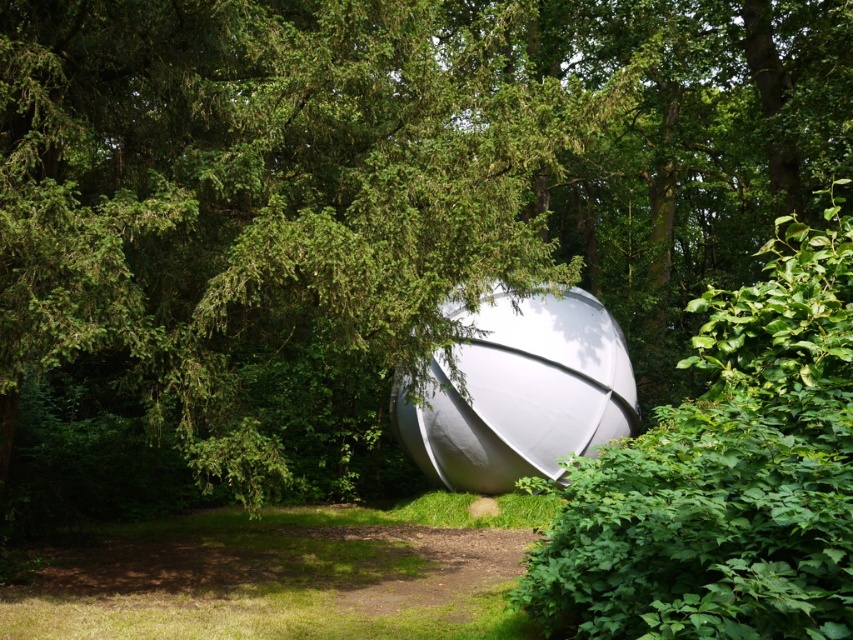
You are a hiker who wants to place a small backpack on the green grass at lower center. However, you need to ensure that the backpack won not block the view of the white matte sphere at center. Can you do this?

The green grass at lower center is not as tall as the white matte sphere at center, so placing the backpack there would not block the view of the white matte sphere at center since the sphere is taller.

You are a hiker who wants to place a small backpack on the ground near the green leafy bush at center. However, you notice the green grass at lower center. Which area would be more suitable for placing your backpack to avoid it being hidden by vegetation?

The green grass at lower center is shorter than the green leafy bush at center, so placing the backpack on the green grass at lower center would prevent it from being hidden by taller vegetation.

You are a hiker who wants to place a small backpack on the ground near the white matte sphere at center. Based on the scene, where should you place it so it stays on the green grass at lower center?

A: You should place the backpack on the green grass at lower center since it is located below the white matte sphere at center, ensuring it stays on the grass.